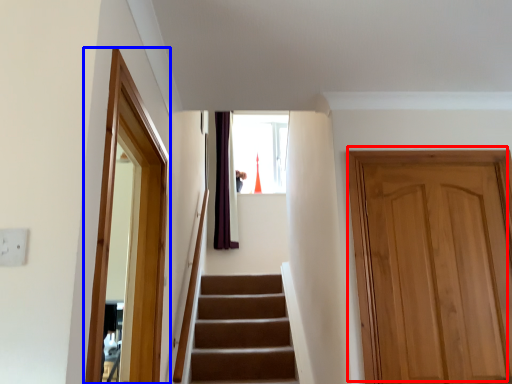
Question: Which object is further to the camera taking this photo, door (highlighted by a red box) or screen door (highlighted by a blue box)?

Choices:
 (A) door
 (B) screen door

Answer: (A)